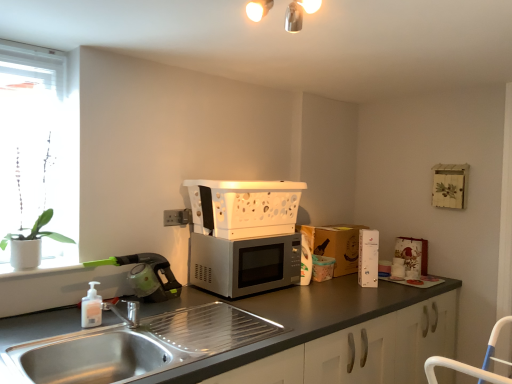
This screenshot has height=384, width=512. What are the coordinates of `white cardboard box at right, which ranks as the 3th appliance in left-to-right order` in the screenshot? It's located at (368, 258).

Measure the distance between point (332, 229) and camera.

They are 8.77 feet apart.

Image resolution: width=512 pixels, height=384 pixels. Describe the element at coordinates (335, 244) in the screenshot. I see `brown cardboard box at right` at that location.

Where is `green plastic vacuum cleaner at left, which is the 3th appliance in right-to-left order`? The height and width of the screenshot is (384, 512). green plastic vacuum cleaner at left, which is the 3th appliance in right-to-left order is located at coordinates (146, 276).

How much space does white plastic microwave at center, positioned as the 2th appliance in left-to-right order, occupy horizontally?

white plastic microwave at center, positioned as the 2th appliance in left-to-right order, is 16.04 inches wide.

The height and width of the screenshot is (384, 512). Describe the element at coordinates (298, 13) in the screenshot. I see `metallic at upper center` at that location.

You are a GUI agent. You are given a task and a screenshot of the screen. Output one action in this format:
    pyautogui.click(x=<x>, y=<y>)
    Task: Click on the white glass window at left
    
    Given the screenshot: What is the action you would take?
    pyautogui.click(x=37, y=156)

Where is `white cardboard box at right, the first appliance positioned from the right`? white cardboard box at right, the first appliance positioned from the right is located at coordinates (368, 258).

The height and width of the screenshot is (384, 512). I want to click on light fixture above the satin silver microwave at center (from the image's perspective), so click(x=298, y=13).

Are metallic at upper center and satin silver microwave at center far apart?

Yes.

From a real-world perspective, does metallic at upper center sit lower than satin silver microwave at center?

No, from a real-world perspective, metallic at upper center is not beneath satin silver microwave at center.

This screenshot has height=384, width=512. I want to click on plant behind the matte gray countertop at center, so click(37, 231).

Is matte gray countertop at center positioned before white matte plant at left?

Yes, matte gray countertop at center is closer to the viewer.

How far apart are matte gray countertop at center and white matte plant at left?

matte gray countertop at center and white matte plant at left are 1.11 meters apart.

From a real-world perspective, relative to white matte plant at left, is matte gray countertop at center vertically above or below?

In terms of real-world spatial position, matte gray countertop at center is below white matte plant at left.

From the picture: Which object is thinner, matte gray countertop at center or white matte soap dispenser at sink left?

With smaller width is white matte soap dispenser at sink left.

Consider the image. Is matte gray countertop at center next to white matte soap dispenser at sink left?

matte gray countertop at center is not next to white matte soap dispenser at sink left, and they're not touching.

Does matte gray countertop at center appear on the left side of white matte soap dispenser at sink left?

In fact, matte gray countertop at center is to the right of white matte soap dispenser at sink left.

Based on the photo, does white glass window at left have a lesser height compared to stainless steel sink at lower left?

No.

How different are the orientations of white glass window at left and stainless steel sink at lower left in degrees?

The angle between the facing direction of white glass window at left and the facing direction of stainless steel sink at lower left is 0.449 degrees.

From a real-world perspective, is white glass window at left positioned under stainless steel sink at lower left based on gravity?

Incorrect, from a real-world perspective, white glass window at left is higher than stainless steel sink at lower left.

Does white glass window at left turn towards stainless steel sink at lower left?

Yes, white glass window at left is aimed at stainless steel sink at lower left.

Who is taller, brown cardboard box at right or matte gray countertop at center?

With more height is matte gray countertop at center.

From the image's perspective, which object appears higher, brown cardboard box at right or matte gray countertop at center?

brown cardboard box at right, from the image's perspective.

Considering the relative sizes of brown cardboard box at right and matte gray countertop at center in the image provided, is brown cardboard box at right wider than matte gray countertop at center?

In fact, brown cardboard box at right might be narrower than matte gray countertop at center.

Considering the positions of objects brown cardboard box at right and matte gray countertop at center in the image provided, who is more to the right, brown cardboard box at right or matte gray countertop at center?

brown cardboard box at right.

Identify the location of countertop directly beneath the stainless steel sink at lower left (from a real-world perspective). The width and height of the screenshot is (512, 384). (237, 335).

From a real-world perspective, is stainless steel sink at lower left on top of matte gray countertop at center?

Correct, in the physical world, stainless steel sink at lower left is higher than matte gray countertop at center.

Considering the relative sizes of stainless steel sink at lower left and matte gray countertop at center in the image provided, is stainless steel sink at lower left taller than matte gray countertop at center?

In fact, stainless steel sink at lower left may be shorter than matte gray countertop at center.

Considering the relative sizes of stainless steel sink at lower left and matte gray countertop at center in the image provided, is stainless steel sink at lower left bigger than matte gray countertop at center?

No, stainless steel sink at lower left is not bigger than matte gray countertop at center.

There is a matte gray countertop at center. Where is `the 2nd appliance above it (from the image's perspective)`? the 2nd appliance above it (from the image's perspective) is located at coordinates (368, 258).

Who is shorter, white cardboard box at right, the first appliance positioned from the right, or matte gray countertop at center?

white cardboard box at right, the first appliance positioned from the right.

Is white cardboard box at right, which ranks as the 3th appliance in left-to-right order, positioned with its back to matte gray countertop at center?

white cardboard box at right, which ranks as the 3th appliance in left-to-right order, is not turned away from matte gray countertop at center.

At what (x,y) coordinates should I click in order to perform the action: click on light fixture that is above the satin silver microwave at center (from a real-world perspective). Please return your answer as a coordinate pair (x, y). The width and height of the screenshot is (512, 384). Looking at the image, I should click on (298, 13).

At what (x,y) coordinates should I click in order to perform the action: click on plant to the left of matte gray countertop at center. Please return your answer as a coordinate pair (x, y). Looking at the image, I should click on (37, 231).

Consider the image. Which object lies nearer to the anchor point white cardboard box at right, which ranks as the 3th appliance in left-to-right order, green plastic vacuum cleaner at left, which is the 3th appliance in right-to-left order, or white plastic electric outlet at center?

white plastic electric outlet at center is positioned closer to the anchor white cardboard box at right, which ranks as the 3th appliance in left-to-right order.

Based on their spatial positions, is white cardboard box at right, which ranks as the 3th appliance in left-to-right order, or matte gray countertop at center closer to white matte plant at left?

matte gray countertop at center lies closer to white matte plant at left than the other object.

Which object lies further to the anchor point matte gray countertop at center, white plastic electric outlet at center or white matte plant at left?

The object further to matte gray countertop at center is white matte plant at left.

In the scene shown: Estimate the real-world distances between objects in this image. Which object is closer to green plastic vacuum cleaner at left, the first appliance positioned from the left, satin silver microwave at center or metallic at upper center?

satin silver microwave at center.

Considering their positions, is white cardboard box at right, the first appliance positioned from the right, positioned further to satin silver microwave at center than white plastic electric outlet at center?

white cardboard box at right, the first appliance positioned from the right, lies further to satin silver microwave at center than the other object.

Which object lies nearer to the anchor point satin silver microwave at center, stainless steel sink at lower left or white matte plant at left?

Among the two, stainless steel sink at lower left is located nearer to satin silver microwave at center.

When comparing their distances from white cardboard box at right, the first appliance positioned from the right, does white plastic electric outlet at center or brown cardboard box at right seem further?

white plastic electric outlet at center lies further to white cardboard box at right, the first appliance positioned from the right, than the other object.

Which object lies nearer to the anchor point white plastic electric outlet at center, white glass window at left or white cardboard box at right, which ranks as the 3th appliance in left-to-right order?

white glass window at left lies closer to white plastic electric outlet at center than the other object.

You are a GUI agent. You are given a task and a screenshot of the screen. Output one action in this format:
    pyautogui.click(x=<x>, y=<y>)
    Task: Click on the plant between matte gray countertop at center and brown cardboard box at right along the z-axis
    This screenshot has height=384, width=512.
    Given the screenshot: What is the action you would take?
    pos(37,231)

Where is `cardboard box between white matte plant at left and white cardboard box at right, the first appliance positioned from the right`? cardboard box between white matte plant at left and white cardboard box at right, the first appliance positioned from the right is located at coordinates (335, 244).

In order to click on sink between white glass window at left and white cardboard box at right, the first appliance positioned from the right, from left to right in this screenshot , I will do `click(139, 346)`.

The width and height of the screenshot is (512, 384). In order to click on appliance between white glass window at left and white plastic electric outlet at center from left to right in this screenshot , I will do `click(146, 276)`.